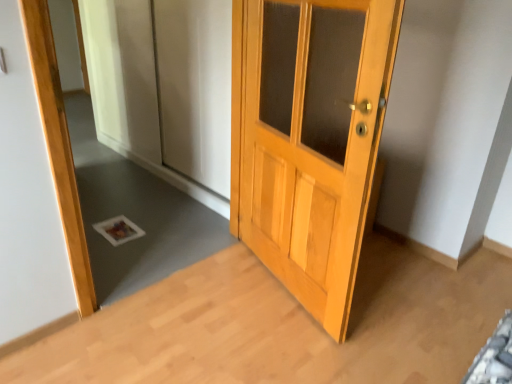
Describe the element at coordinates (133, 143) in the screenshot. The height and width of the screenshot is (384, 512). I see `white glossy mirror at lower left` at that location.

Where is `white glossy mirror at lower left`? white glossy mirror at lower left is located at coordinates (133, 143).

This screenshot has width=512, height=384. What are the coordinates of `light brown wooden door at center` in the screenshot? It's located at (309, 139).

Describe the element at coordinates (309, 139) in the screenshot. Image resolution: width=512 pixels, height=384 pixels. I see `light brown wooden door at center` at that location.

At what (x,y) coordinates should I click in order to perform the action: click on white glossy mirror at lower left. Please return your answer as a coordinate pair (x, y). Image resolution: width=512 pixels, height=384 pixels. Looking at the image, I should click on (133, 143).

Does white glossy mirror at lower left appear on the left side of light brown wooden door at center?

Yes, white glossy mirror at lower left is to the left of light brown wooden door at center.

Which object is further away from the camera, white glossy mirror at lower left or light brown wooden door at center?

white glossy mirror at lower left is behind.

Considering the positions of point (127, 122) and point (320, 220), is point (127, 122) closer or farther from the camera than point (320, 220)?

Point (127, 122) appears to be farther away from the viewer than point (320, 220).

From the image's perspective, which object appears higher, white glossy mirror at lower left or light brown wooden door at center?

white glossy mirror at lower left appears higher in the image.

From a real-world perspective, relative to light brown wooden door at center, is white glossy mirror at lower left vertically above or below?

white glossy mirror at lower left is situated lower than light brown wooden door at center in the real world.

In terms of width, does white glossy mirror at lower left look wider or thinner when compared to light brown wooden door at center?

white glossy mirror at lower left is thinner than light brown wooden door at center.

Who is shorter, white glossy mirror at lower left or light brown wooden door at center?

white glossy mirror at lower left.

Based on their sizes in the image, would you say white glossy mirror at lower left is bigger or smaller than light brown wooden door at center?

Clearly, white glossy mirror at lower left is smaller in size than light brown wooden door at center.

Which is correct: white glossy mirror at lower left is inside light brown wooden door at center, or outside of it?

The correct answer is: outside.

Is white glossy mirror at lower left beside light brown wooden door at center?

white glossy mirror at lower left and light brown wooden door at center are not in contact.

Is white glossy mirror at lower left positioned with its back to light brown wooden door at center?

white glossy mirror at lower left is not turned away from light brown wooden door at center.

Measure the distance between white glossy mirror at lower left and light brown wooden door at center.

white glossy mirror at lower left is 37.85 inches away from light brown wooden door at center.

You are a GUI agent. You are given a task and a screenshot of the screen. Output one action in this format:
    pyautogui.click(x=<x>, y=<y>)
    Task: Click on the mirror on the left of light brown wooden door at center
    The width and height of the screenshot is (512, 384).
    Given the screenshot: What is the action you would take?
    pyautogui.click(x=133, y=143)

Which object is positioned more to the left, light brown wooden door at center or white glossy mirror at lower left?

white glossy mirror at lower left is more to the left.

In the scene shown: Which is behind, light brown wooden door at center or white glossy mirror at lower left?

white glossy mirror at lower left is behind.

Between point (269, 75) and point (146, 178), which one is positioned behind?

The point (146, 178) is behind.

From the image's perspective, is light brown wooden door at center over white glossy mirror at lower left?

Actually, light brown wooden door at center appears below white glossy mirror at lower left in the image.

From a real-world perspective, between light brown wooden door at center and white glossy mirror at lower left, who is vertically higher?

From a 3D spatial view, light brown wooden door at center is above.

Considering the relative sizes of light brown wooden door at center and white glossy mirror at lower left in the image provided, is light brown wooden door at center wider than white glossy mirror at lower left?

Yes, light brown wooden door at center is wider than white glossy mirror at lower left.

In terms of height, does light brown wooden door at center look taller or shorter compared to white glossy mirror at lower left?

light brown wooden door at center is taller than white glossy mirror at lower left.

Considering the sizes of objects light brown wooden door at center and white glossy mirror at lower left in the image provided, who is bigger, light brown wooden door at center or white glossy mirror at lower left?

light brown wooden door at center is bigger.

Is light brown wooden door at center inside the boundaries of white glossy mirror at lower left, or outside?

light brown wooden door at center cannot be found inside white glossy mirror at lower left.

Would you say light brown wooden door at center is a long distance from white glossy mirror at lower left?

Actually, light brown wooden door at center and white glossy mirror at lower left are a little close together.

Does light brown wooden door at center turn towards white glossy mirror at lower left?

Yes, light brown wooden door at center faces towards white glossy mirror at lower left.

What's the angular difference between light brown wooden door at center and white glossy mirror at lower left's facing directions?

The facing directions of light brown wooden door at center and white glossy mirror at lower left are 103 degrees apart.

How much distance is there between light brown wooden door at center and white glossy mirror at lower left?

37.85 inches.

This screenshot has width=512, height=384. I want to click on door below the white glossy mirror at lower left (from the image's perspective), so click(309, 139).

This screenshot has height=384, width=512. What are the coordinates of `mirror below the light brown wooden door at center (from a real-world perspective)` in the screenshot? It's located at (133, 143).

This screenshot has width=512, height=384. What are the coordinates of `door that is below the white glossy mirror at lower left (from the image's perspective)` in the screenshot? It's located at (309, 139).